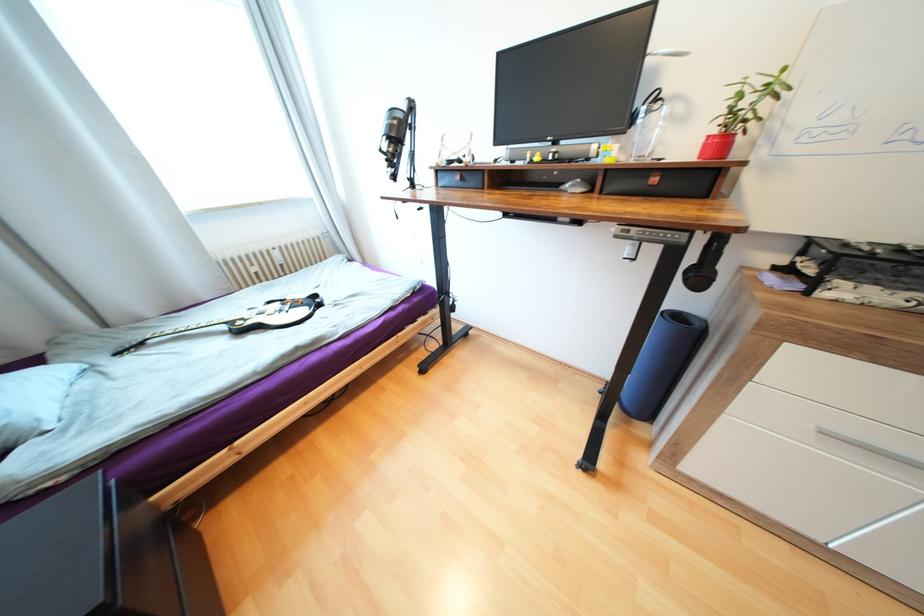
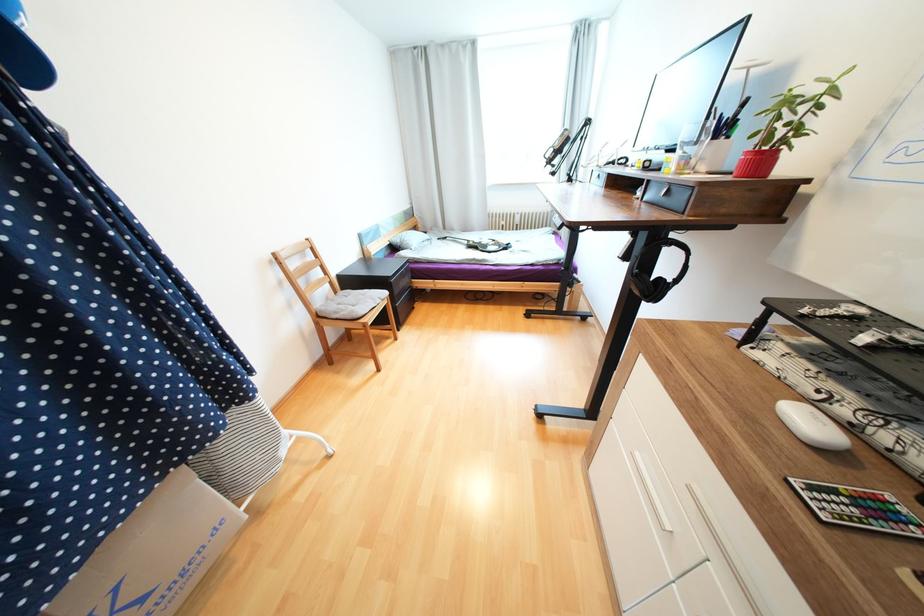
Find the pixel in the second image that matches pixel 229 328 in the first image.

(471, 243)